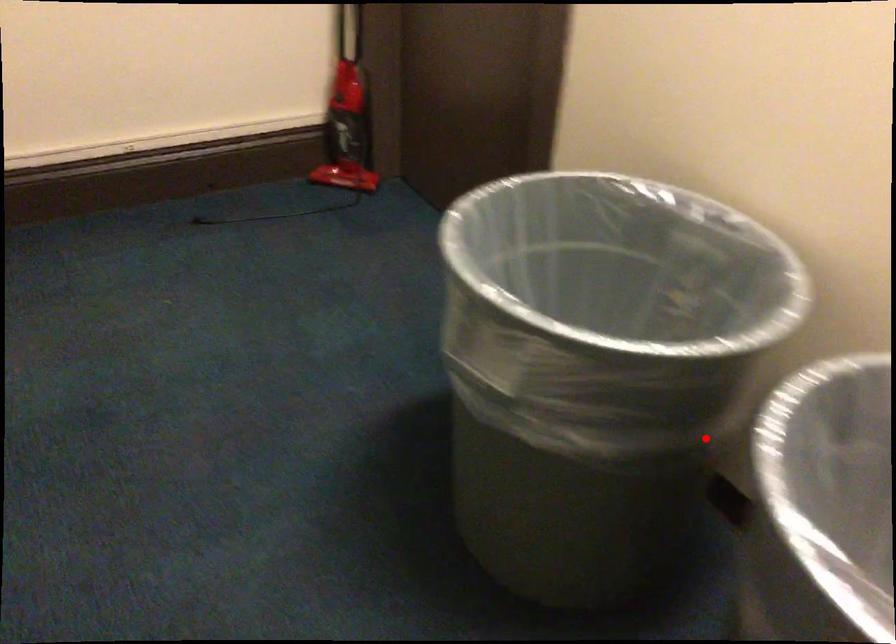
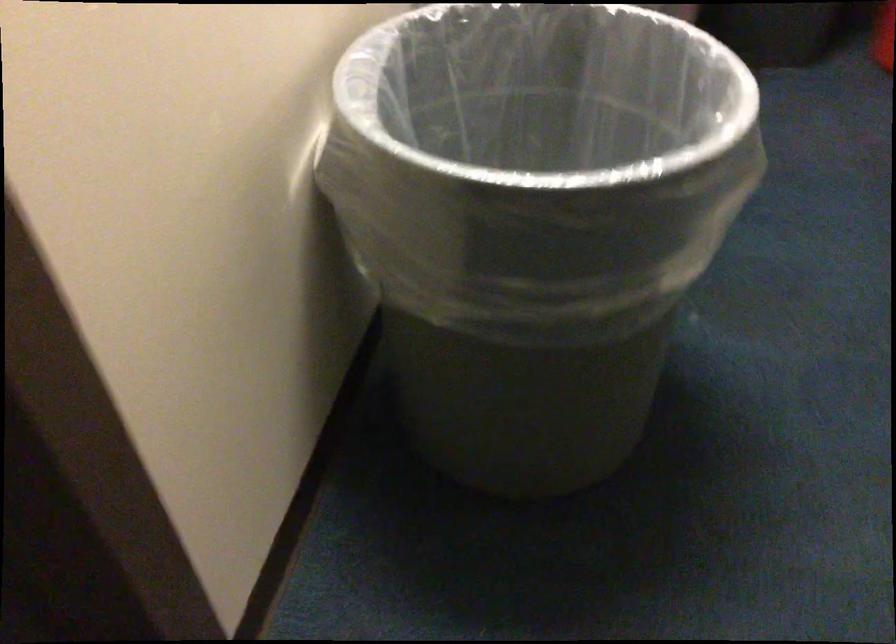
Question: I am providing you with two images of the same scene from different viewpoints. In image1, a red point is highlighted. Considering the same 3D point in image2, which of the following is correct?

Choices:
 (A) It is closer
 (B) It is farther

Answer: (B)